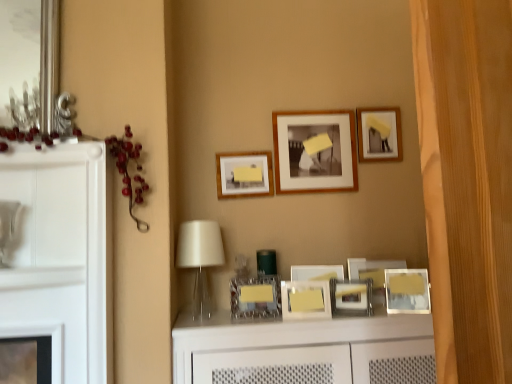
The height and width of the screenshot is (384, 512). I want to click on free space in front of metallic silver picture frame at center, the 5th picture frame in the top-to-bottom sequence, so click(386, 312).